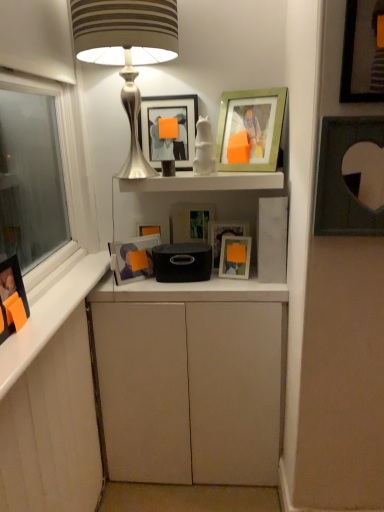
Find the location of `spots to the right of matte black picture frame at left, the ninth picture frame positioned from the right`. spots to the right of matte black picture frame at left, the ninth picture frame positioned from the right is located at coordinates (27, 346).